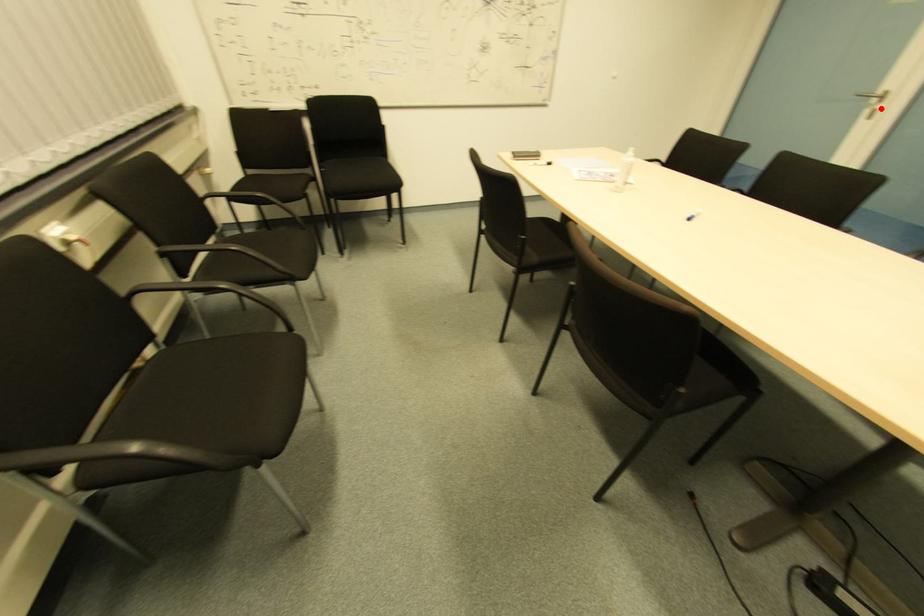
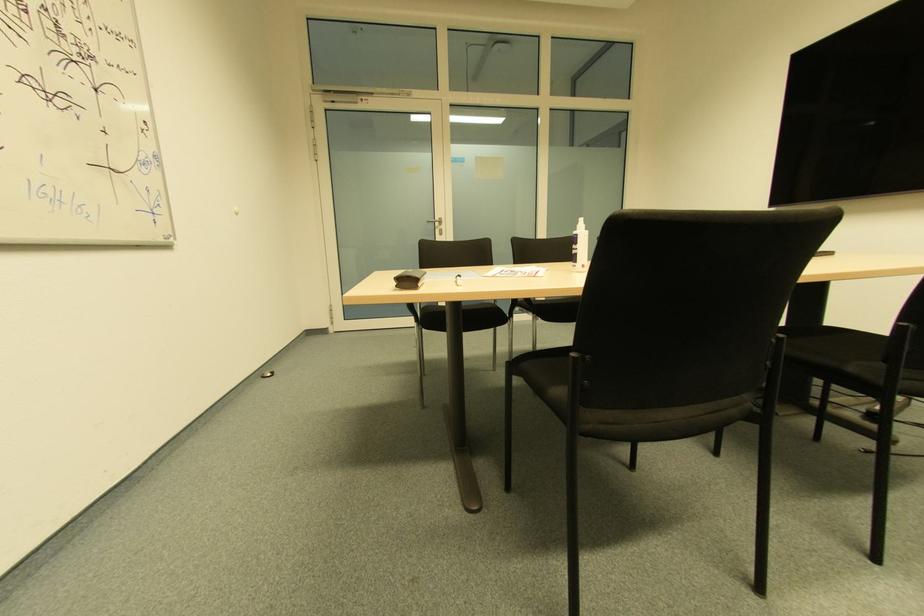
The point at the highlighted location is marked in the first image. Where is the corresponding point in the second image?

(440, 230)